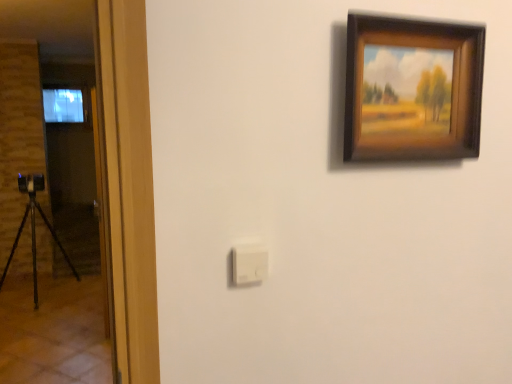
Question: Considering the positions of white plastic light switch at center and wooden frame at upper right in the image, is white plastic light switch at center bigger or smaller than wooden frame at upper right?

Choices:
 (A) big
 (B) small

Answer: (B)

Question: From the image's perspective, relative to wooden frame at upper right, is white plastic light switch at center above or below?

Choices:
 (A) below
 (B) above

Answer: (A)

Question: Considering their positions, is white plastic light switch at center located in front of or behind wooden frame at upper right?

Choices:
 (A) behind
 (B) front

Answer: (A)

Question: Considering the positions of wooden frame at upper right and white plastic light switch at center in the image, is wooden frame at upper right wider or thinner than white plastic light switch at center?

Choices:
 (A) wide
 (B) thin

Answer: (A)

Question: Is wooden frame at upper right inside the boundaries of white plastic light switch at center, or outside?

Choices:
 (A) inside
 (B) outside

Answer: (B)

Question: Considering the positions of point (346, 110) and point (240, 281), is point (346, 110) closer or farther from the camera than point (240, 281)?

Choices:
 (A) closer
 (B) farther

Answer: (B)

Question: Based on their sizes in the image, would you say wooden frame at upper right is bigger or smaller than white plastic light switch at center?

Choices:
 (A) small
 (B) big

Answer: (B)